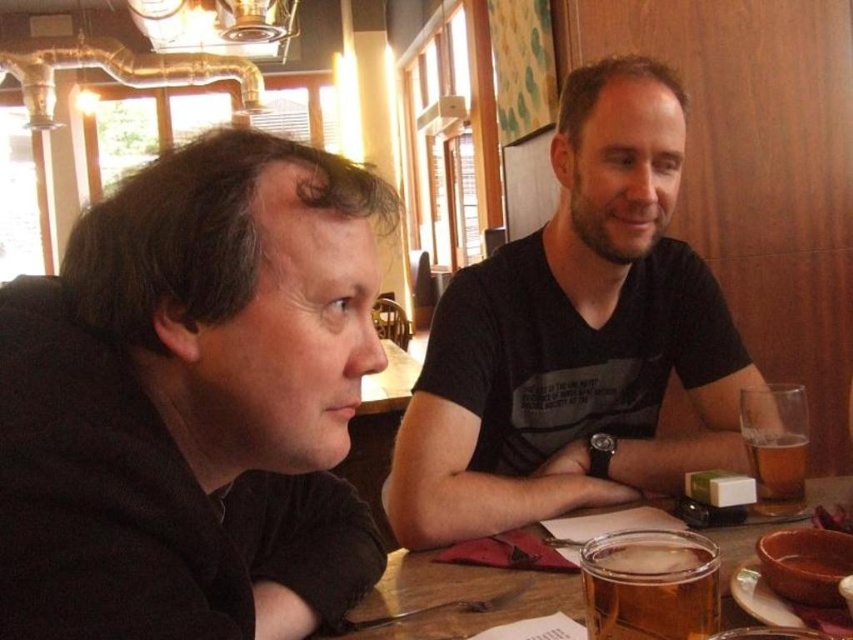
Question: Which of the following is the closest to the observer?

Choices:
 (A) translucent glass beer at lower center
 (B) black matte shirt at left

Answer: (B)

Question: Among these objects, which one is nearest to the camera?

Choices:
 (A) translucent glass beer at right
 (B) black matte shirt at left

Answer: (B)

Question: Which point is closer to the camera?

Choices:
 (A) (784, 484)
 (B) (746, 621)
 (C) (616, 432)

Answer: (B)

Question: In this image, where is black matte shirt at center located relative to translucent glass beer at right?

Choices:
 (A) right
 (B) left

Answer: (B)

Question: Is black matte shirt at left below translucent glass beer at right?

Choices:
 (A) yes
 (B) no

Answer: (B)

Question: From the image, what is the correct spatial relationship of black matte shirt at center in relation to translucent glass beer at lower center?

Choices:
 (A) right
 (B) left

Answer: (A)